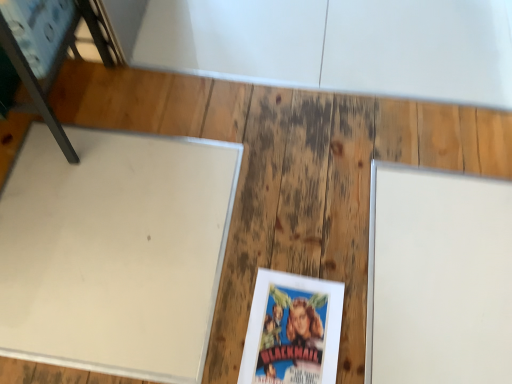
Question: Is matte paper book at center situated inside white matte board at right or outside?

Choices:
 (A) inside
 (B) outside

Answer: (B)

Question: In the image, is matte paper book at center positioned in front of or behind white matte board at right?

Choices:
 (A) front
 (B) behind

Answer: (A)

Question: Which is farther from the white matte board at left?

Choices:
 (A) matte paper book at center
 (B) white matte board at right
 (C) metallic blue chair at upper left

Answer: (B)

Question: Which of these objects is positioned closest to the white matte board at left?

Choices:
 (A) white matte board at right
 (B) matte paper book at center
 (C) metallic blue chair at upper left

Answer: (C)